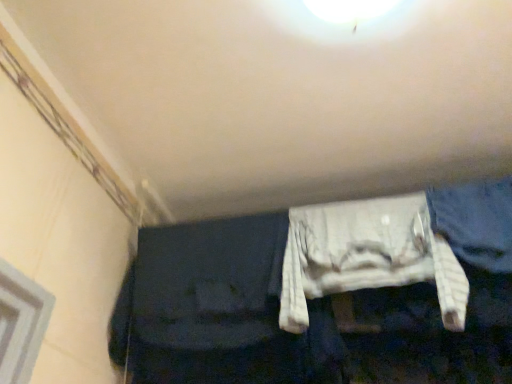
Question: Is denim at right positioned beyond the bounds of white fabric cushion at center?

Choices:
 (A) no
 (B) yes

Answer: (B)

Question: Is denim at right at the left side of white fabric cushion at center?

Choices:
 (A) no
 (B) yes

Answer: (A)

Question: Is denim at right further to the viewer compared to white fabric cushion at center?

Choices:
 (A) no
 (B) yes

Answer: (B)

Question: Does denim at right touch white fabric cushion at center?

Choices:
 (A) yes
 (B) no

Answer: (B)

Question: Does denim at right appear on the right side of white fabric cushion at center?

Choices:
 (A) no
 (B) yes

Answer: (B)

Question: Considering the relative sizes of denim at right and white fabric cushion at center in the image provided, is denim at right smaller than white fabric cushion at center?

Choices:
 (A) yes
 (B) no

Answer: (A)

Question: From the image's perspective, is white fabric cushion at center under denim at right?

Choices:
 (A) yes
 (B) no

Answer: (A)

Question: Considering the relative sizes of white fabric cushion at center and denim at right in the image provided, is white fabric cushion at center bigger than denim at right?

Choices:
 (A) yes
 (B) no

Answer: (A)

Question: Does white fabric cushion at center have a greater width compared to denim at right?

Choices:
 (A) no
 (B) yes

Answer: (B)

Question: Can you confirm if white fabric cushion at center is positioned to the right of denim at right?

Choices:
 (A) no
 (B) yes

Answer: (A)

Question: Is the position of white fabric cushion at center more distant than that of denim at right?

Choices:
 (A) yes
 (B) no

Answer: (B)

Question: Can you confirm if white fabric cushion at center is thinner than denim at right?

Choices:
 (A) no
 (B) yes

Answer: (A)

Question: Is white fabric cushion at center wider or thinner than denim at right?

Choices:
 (A) thin
 (B) wide

Answer: (B)